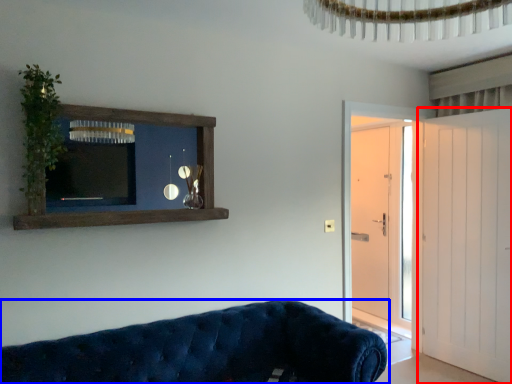
Question: Which object appears closest to the camera in this image, door (highlighted by a red box) or studio couch (highlighted by a blue box)?

Choices:
 (A) door
 (B) studio couch

Answer: (B)